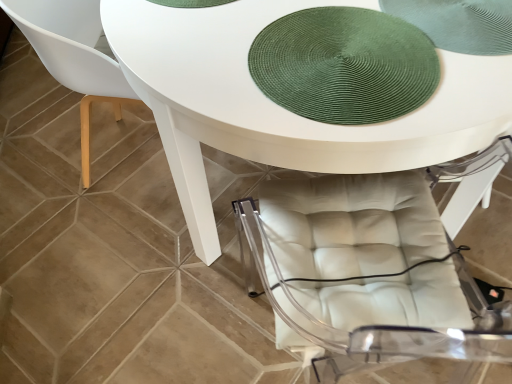
Locate an element on the screen. vacant space to the left of matte white chair at lower left is located at coordinates (42, 157).